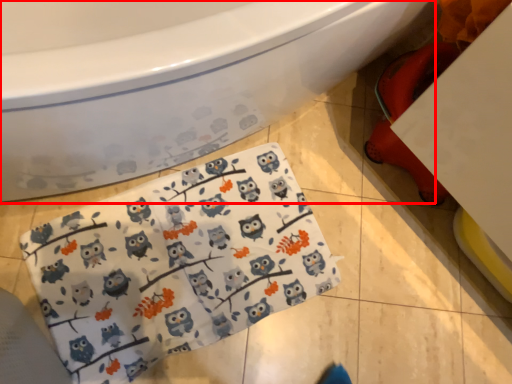
Question: In this image, where is bathtub (annotated by the red box) located relative to baby clothe?

Choices:
 (A) left
 (B) right

Answer: (A)